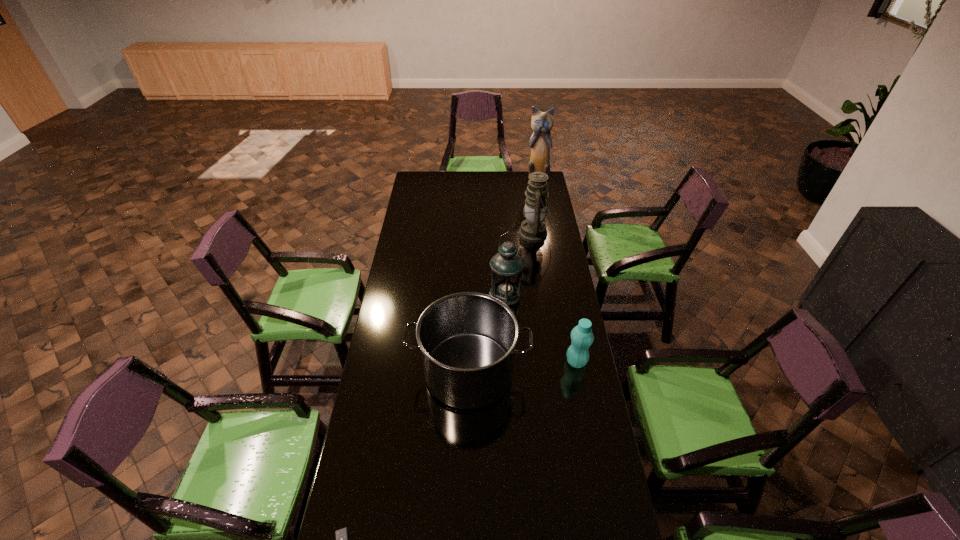
In order to click on the tallest object in this screenshot , I will do `click(542, 122)`.

What are the coordinates of `cat` in the screenshot? It's located at (542, 122).

Locate an element on the screen. This screenshot has width=960, height=540. the fourth nearest object is located at coordinates (507, 266).

The image size is (960, 540). Find the location of `the nearer oil lamp`. the nearer oil lamp is located at coordinates (507, 266).

The width and height of the screenshot is (960, 540). I want to click on the fifth nearest object, so click(x=533, y=229).

This screenshot has width=960, height=540. I want to click on the farther oil lamp, so click(533, 229).

Identify the location of saucepan. Image resolution: width=960 pixels, height=540 pixels. (467, 340).

Identify the location of bottle. (582, 337).

Find the location of a particular element. The width and height of the screenshot is (960, 540). vacant area situated 0.190m on the face of the cat is located at coordinates click(x=541, y=206).

This screenshot has height=540, width=960. I want to click on free region located on the right of the fourth nearest object, so click(548, 294).